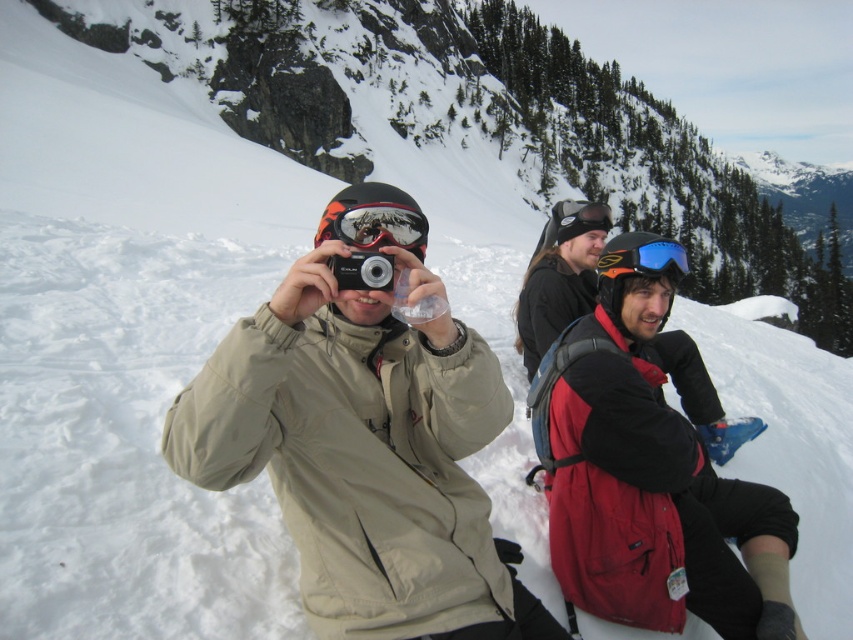
You are an optometrist examining two pairs of goggles in the image. Which pair has a wider lens? The two pairs are the blue reflective lens goggles at upper center and the blue reflective goggles at upper center.

The blue reflective lens goggles at upper center has a larger width than the blue reflective goggles at upper center, so the blue reflective lens goggles at upper center has a wider lens.

In the snowy mountain scene, there are three people. The first person is taking a photo, wearing a beige jacket and black helmet with red and orange designs. To their right is someone sitting on the snow in a black jacket with a red backpack and blue goggles. The third person is marked by the point at (363, 458). What is the third person wearing?

The third person at point (363, 458) is wearing a matte khaki jacket at center.

You are a photographer trying to capture a photo of the matte black goggles at center in the snowy mountain scene. Based on their coordinates, where should you aim your camera?

The matte black goggles at center are located at coordinates point (376, 225), so aim your camera at that point to capture them.